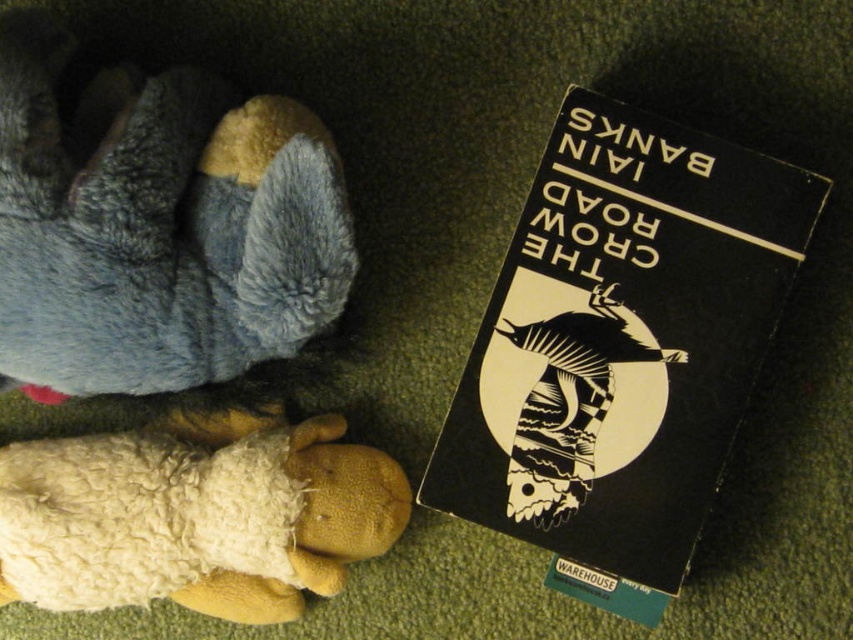
You are a photographer trying to capture both the black matte paper at upper right and the white woolen sheep at lower left in the same frame. Which object should you focus on first to ensure both are in focus?

You should focus on the white woolen sheep at lower left first because it is closer to the viewer than the black matte paper at upper right. By focusing on the closer object, the further one will also be in focus due to the depth of field.

You are a person sitting on the floor and looking at the image. You want to place a small sticker exactly at the center of the black matte paper at upper right. What are the coordinates where you should place the sticker?

The coordinates to place the sticker at the center of the black matte paper at upper right are (622, 342).